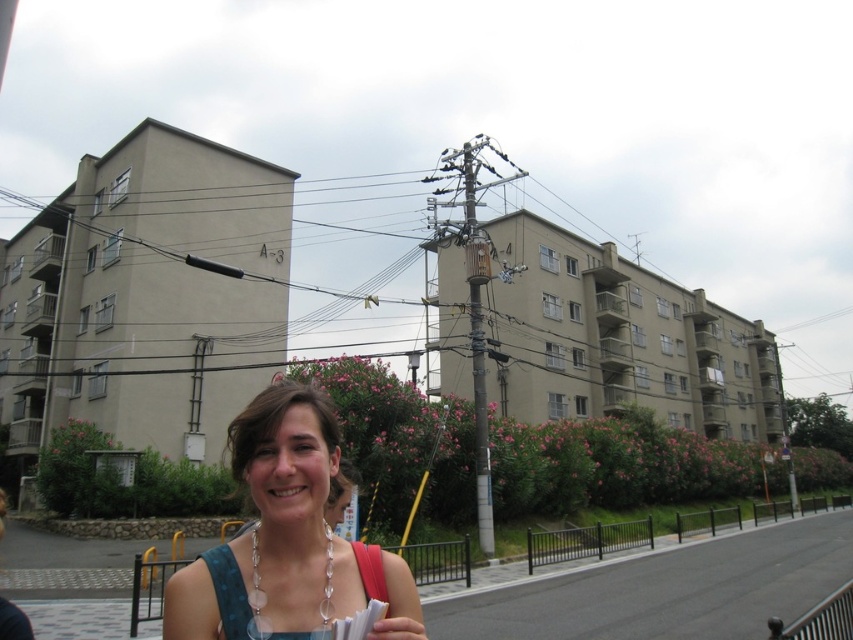
Consider the image. You are a photographer taking a portrait of the woman in the scene. You need to ensure that both the matte blue dress at center and the smooth skin hand at lower center are clearly visible in the photo. Which object should you focus on to ensure both are in sharp focus?

The matte blue dress at center is larger in size than the smooth skin hand at lower center, so focusing on the larger object, the matte blue dress at center, will help ensure both are in sharp focus.

You are a photographer trying to capture the matte blue dress at center in your shot. The camera is positioned at point 0.5, 0.5. Can you determine if the dress is within the camera frame?

The matte blue dress at center is located at point (274, 532), which is outside the camera frame centered at (426, 320) with a standard field of view. Therefore, the dress may not be fully visible unless the camera adjusts its angle or zoom.

You are standing in the urban residential area shown in the image. You notice two points marked as point 1 at coordinates point (312, 426) and point 2 at coordinates point (372, 636). Which point is closer to you?

Point (312, 426) is closer to you because it is further to the viewer than point (372, 636).